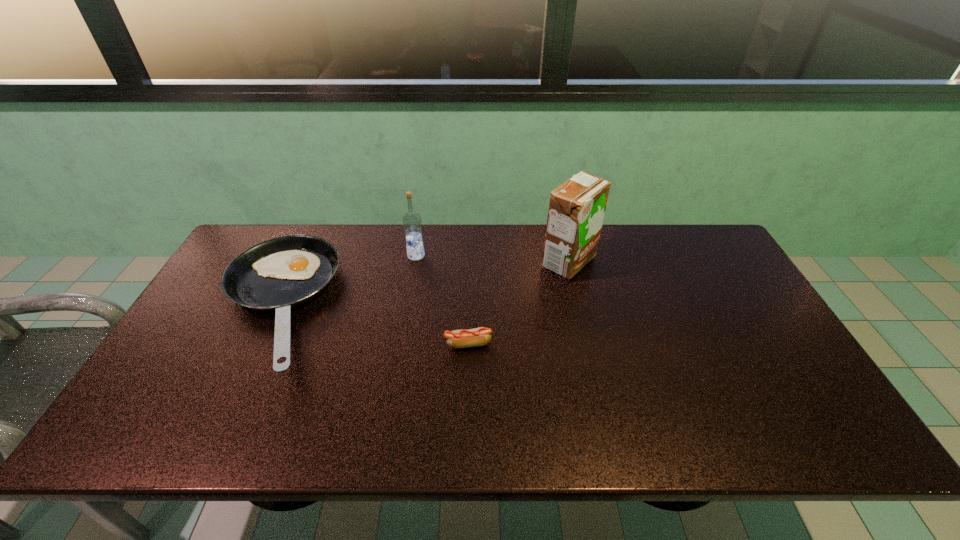
This screenshot has width=960, height=540. I want to click on the tallest object, so click(577, 207).

Where is `carton`? carton is located at coordinates (577, 207).

Where is `the second object from left to right`? This screenshot has width=960, height=540. the second object from left to right is located at coordinates (412, 222).

At what (x,y) coordinates should I click in order to perform the action: click on vodka. Please return your answer as a coordinate pair (x, y). Image resolution: width=960 pixels, height=540 pixels. Looking at the image, I should click on (412, 222).

Locate an element on the screen. frying pan is located at coordinates click(278, 274).

In order to click on the third tallest object in this screenshot , I will do click(x=278, y=274).

I want to click on the shortest object, so click(x=464, y=338).

Identify the location of the third object from left to right. The height and width of the screenshot is (540, 960). (464, 338).

In order to click on free space located on the straw side of the tallest object in this screenshot , I will do `click(485, 262)`.

Identify the location of vacant space situated 0.090m on the straw side of the tallest object. This screenshot has height=540, width=960. tap(513, 262).